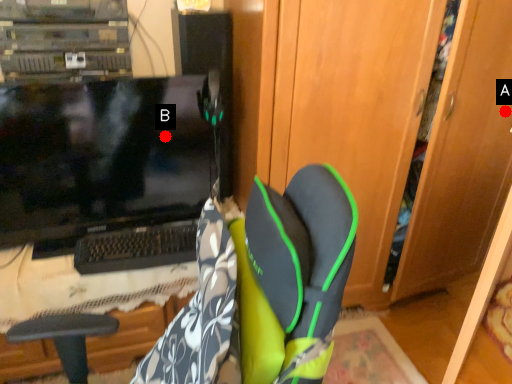
Question: Two points are circled on the image, labeled by A and B beside each circle. Which of the following is the closest to the observer?

Choices:
 (A) A is closer
 (B) B is closer

Answer: (B)